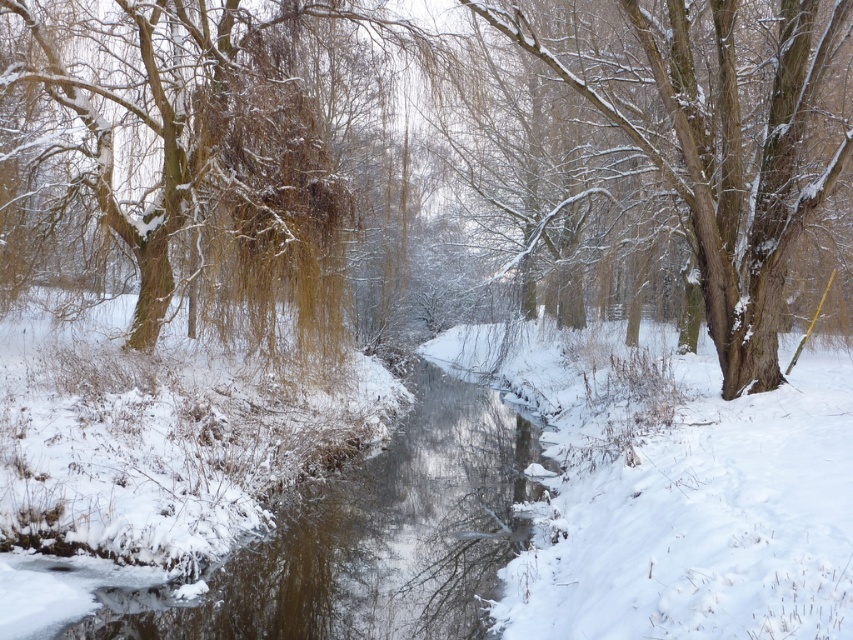
Does snow-covered willow at center appear on the left side of clear water at center?

Correct, you'll find snow-covered willow at center to the left of clear water at center.

Is the position of snow-covered willow at center more distant than that of clear water at center?

Yes, it is behind clear water at center.

Is point (28, 122) positioned before point (416, 500)?

No.

At what (x,y) coordinates should I click in order to perform the action: click on snow-covered willow at center. Please return your answer as a coordinate pair (x, y). The image size is (853, 640). Looking at the image, I should click on (183, 157).

Can you confirm if snow-covered bark tree at center is thinner than clear water at center?

Incorrect, snow-covered bark tree at center's width is not less than clear water at center's.

How distant is snow-covered bark tree at center from clear water at center?

6.80 meters

Which is in front, point (838, 168) or point (457, 618)?

Point (457, 618) is in front.

Where is `snow-covered bark tree at center`? This screenshot has height=640, width=853. snow-covered bark tree at center is located at coordinates 720,138.

Can you confirm if snow-covered willow at center is taller than snow-covered bark tree at center?

No, snow-covered willow at center is not taller than snow-covered bark tree at center.

Find the location of `snow-covered willow at center`. snow-covered willow at center is located at coordinates (183, 157).